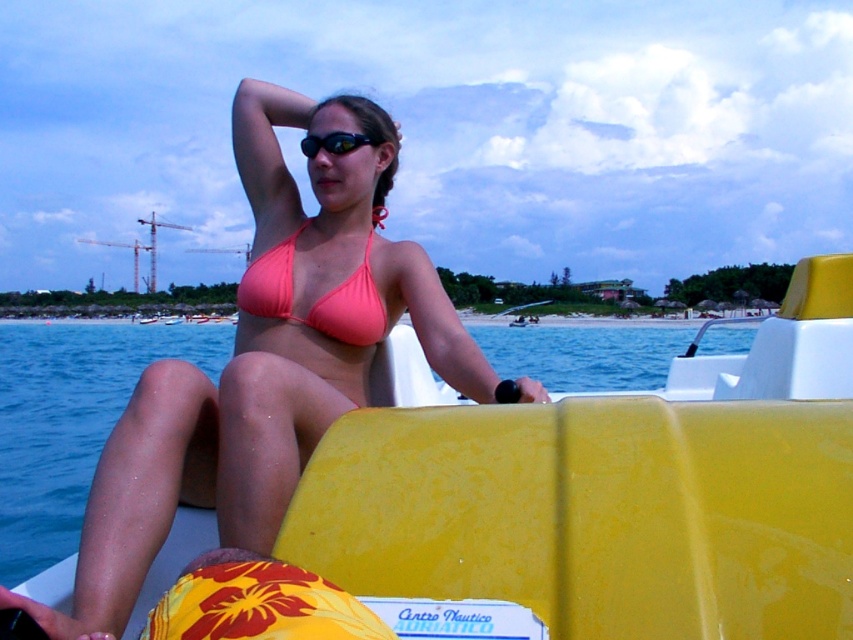
You are a lifeguard on duty and notice a swimmer wearing the black rubber goggles at upper center. You need to reach them quickly using the yellow plastic boat at center. Which direction should you steer the boat to reach the swimmer?

The yellow plastic boat at center is positioned on the right side of the black rubber goggles at upper center. To reach the swimmer wearing the black rubber goggles at upper center, you should steer the boat to the left.

You are a lifeguard standing on the beach and you see a swimmer who needs assistance. The swimmer is near the yellow plastic boat at center and the black rubber goggles at upper center. Which object is closer to the shore? Please explain your reasoning based on their positions.

The yellow plastic boat at center is positioned under the black rubber goggles at upper center. Since the boat is below the goggles in the image, it is closer to the shore, making it the closer object to reach first.

You are a lifeguard observing the scene and need to determine if the pink matte bikini at center and the pink matte bikini top at center are separate items. Based on the spatial information provided, are they positioned far enough apart to be considered distinct objects?

The pink matte bikini at center is 18.70 inches from the pink matte bikini top at center. Since the distance between them is significant, they are positioned far enough apart to be considered distinct objects.